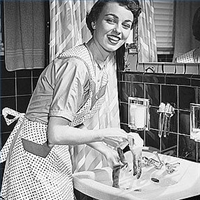
Find the location of `mirror`. mirror is located at coordinates (167, 25).